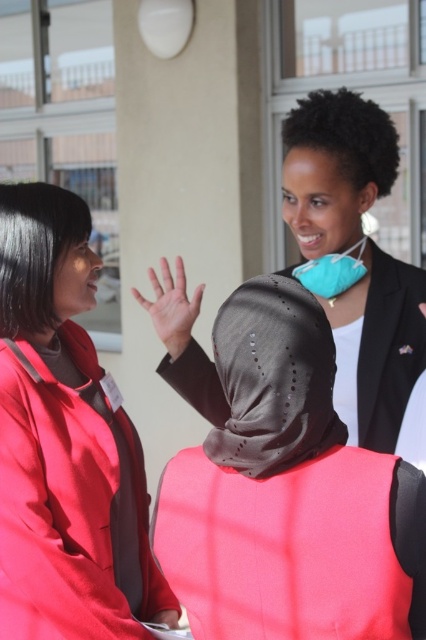
Which is behind, point (11, 451) or point (253, 352)?

The point (11, 451) is more distant.

This screenshot has width=426, height=640. What are the coordinates of `matte red jacket at left` in the screenshot? It's located at (63, 442).

Is point (22, 572) less distant than point (324, 419)?

No, it is behind (324, 419).

Locate an element on the screen. matte red jacket at left is located at coordinates (63, 442).

How much distance is there between matte black hijab at center and smooth skin hand at center?

They are 19.17 inches apart.

Does point (354, 96) come in front of point (172, 282)?

Yes.

In order to click on matte black hijab at center in this screenshot , I will do `click(356, 257)`.

Is black matte shawl at center positioned before smooth skin hand at center?

Yes, it is.

You are a GUI agent. You are given a task and a screenshot of the screen. Output one action in this format:
    pyautogui.click(x=<x>, y=<y>)
    Task: Click on the black matte shawl at center
    
    Given the screenshot: What is the action you would take?
    pyautogui.click(x=273, y=378)